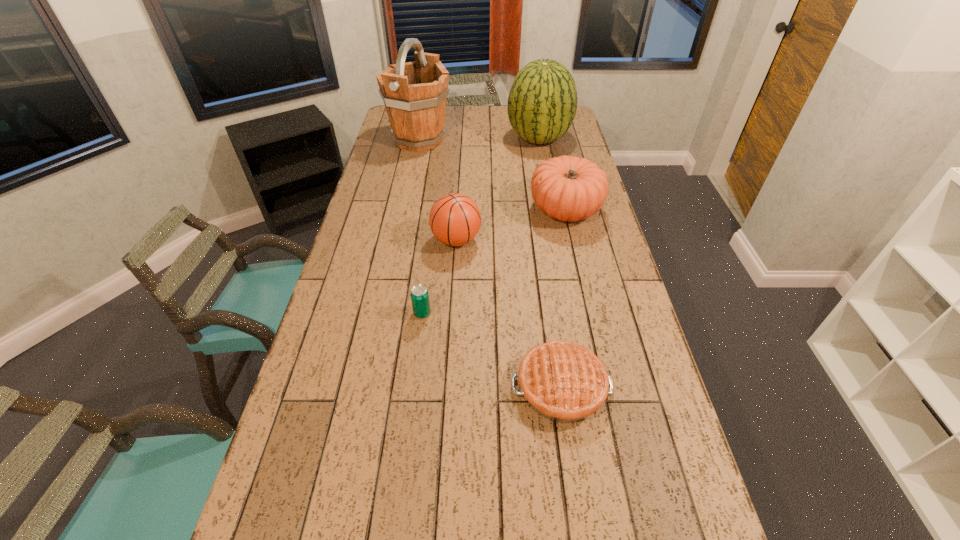
Identify which object is the third nearest to the fifth shortest object. Please provide its 2D coordinates. Your answer should be formatted as a tuple, i.e. [(x, y)], where the tuple contains the x and y coordinates of a point satisfying the conditions above.

[(455, 219)]

Identify which object is the second closest to the beer can. Please provide its 2D coordinates. Your answer should be formatted as a tuple, i.e. [(x, y)], where the tuple contains the x and y coordinates of a point satisfying the conditions above.

[(564, 382)]

You are a GUI agent. You are given a task and a screenshot of the screen. Output one action in this format:
    pyautogui.click(x=<x>, y=<y>)
    Task: Click on the blank area in the image that satisfies the following two spatial constraints: 1. on the back side of the watermelon; 2. on the right side of the pie
    This screenshot has width=960, height=540.
    Given the screenshot: What is the action you would take?
    pyautogui.click(x=524, y=139)

At what (x,y) coordinates should I click in order to perform the action: click on vacant area in the image that satisfies the following two spatial constraints: 1. on the back side of the beer can; 2. on the left side of the second tallest object. Please return your answer as a coordinate pair (x, y). The width and height of the screenshot is (960, 540). Looking at the image, I should click on (444, 139).

Find the location of a particular element. Image resolution: width=960 pixels, height=540 pixels. free spot that satisfies the following two spatial constraints: 1. on the front side of the pumpkin; 2. on the left side of the tallest object is located at coordinates (405, 210).

The height and width of the screenshot is (540, 960). Identify the location of free space in the image that satisfies the following two spatial constraints: 1. on the front side of the watermelon; 2. on the right side of the pumpkin. (552, 210).

The image size is (960, 540). In order to click on vacant region that satisfies the following two spatial constraints: 1. on the back side of the second nearest object; 2. on the right side of the basketball in this screenshot , I will do `click(431, 240)`.

Identify the location of free spot that satisfies the following two spatial constraints: 1. on the front side of the pumpkin; 2. on the right side of the bucket. click(x=405, y=210).

Find the location of `vacant region that satisfies the following two spatial constraints: 1. on the front side of the basketball; 2. on the right side of the tallest object`. vacant region that satisfies the following two spatial constraints: 1. on the front side of the basketball; 2. on the right side of the tallest object is located at coordinates (399, 240).

Where is `vacant space that satisfies the following two spatial constraints: 1. on the back side of the fifth farthest object; 2. on the left side of the second tallest object`? vacant space that satisfies the following two spatial constraints: 1. on the back side of the fifth farthest object; 2. on the left side of the second tallest object is located at coordinates (444, 139).